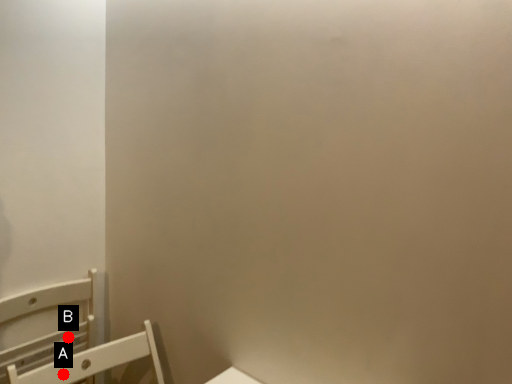
Question: Two points are circled on the image, labeled by A and B beside each circle. Which point appears farthest from the camera in this image?

Choices:
 (A) A is further
 (B) B is further

Answer: (B)